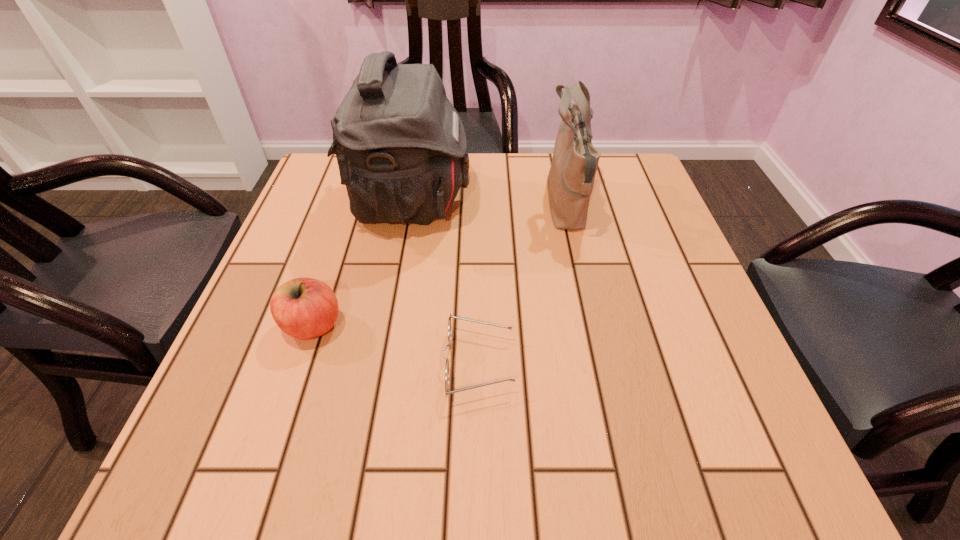
I want to click on the taller shoulder bag, so click(401, 148).

This screenshot has width=960, height=540. Identify the location of the left shoulder bag. (401, 148).

The height and width of the screenshot is (540, 960). Find the location of `the right shoulder bag`. the right shoulder bag is located at coordinates click(x=570, y=181).

The height and width of the screenshot is (540, 960). Find the location of `the shorter shoulder bag`. the shorter shoulder bag is located at coordinates (570, 181).

The width and height of the screenshot is (960, 540). In order to click on the second shortest object in this screenshot , I will do [304, 308].

Locate an element on the screen. the shortest object is located at coordinates (447, 392).

The image size is (960, 540). Identify the location of vacant space positioned 0.370m on the open flap of the left shoulder bag. (623, 202).

In order to click on vacant position located 0.150m on the front-facing side of the second tallest object in this screenshot , I will do (481, 206).

I want to click on vacant space positioned 0.350m on the front-facing side of the second tallest object, so (x=397, y=206).

I want to click on vacant space located on the front-facing side of the second tallest object, so click(x=444, y=206).